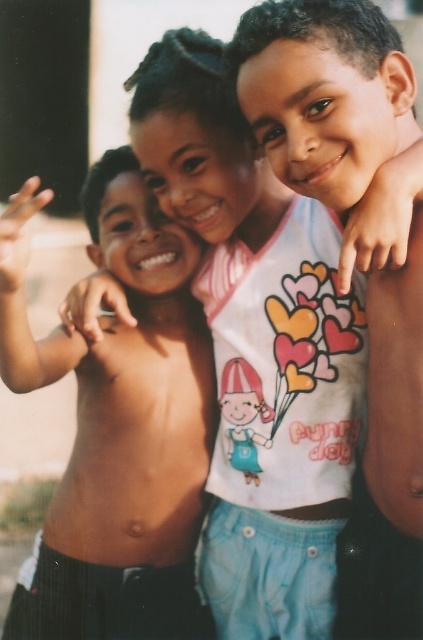
You are standing at the point with coordinates point (331, 179) and want to walk to the point with coordinates point (172, 476). Which direction should you move in?

You should move forward because point (172, 476) is behind point (331, 179).

You are a photographer trying to capture the three children in the scene. You notice a point marked at coordinates (118, 426). Based on the scene description, what is the significance of this point?

The point at coordinates (118, 426) marks the location of shiny skin on the child at left.